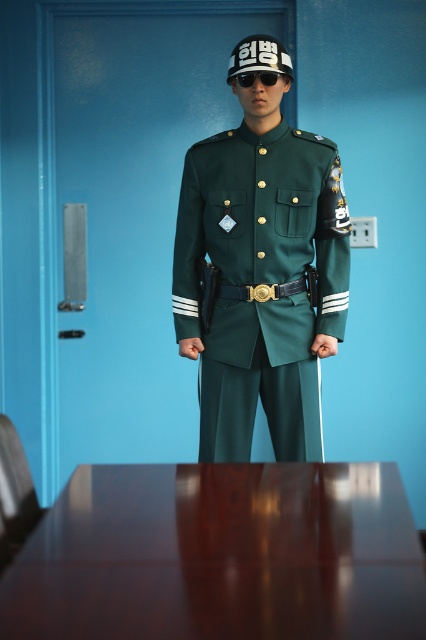
Question: Can you confirm if green matte uniform at center is smaller than black plastic sunglasses at center?

Choices:
 (A) yes
 (B) no

Answer: (B)

Question: From the image, what is the correct spatial relationship of gold metallic belt at center in relation to black plastic sunglasses at center?

Choices:
 (A) below
 (B) above

Answer: (A)

Question: Which object is positioned closest to the gold metallic belt at center?

Choices:
 (A) glossy wood table at lower center
 (B) black plastic sunglasses at center

Answer: (B)

Question: Does green matte uniform at center have a lesser width compared to black plastic sunglasses at center?

Choices:
 (A) yes
 (B) no

Answer: (B)

Question: Among these objects, which one is farthest from the camera?

Choices:
 (A) green matte uniform at center
 (B) gold metallic belt at center

Answer: (B)

Question: Which object is the farthest from the black plastic sunglasses at center?

Choices:
 (A) glossy wood table at lower center
 (B) green matte uniform at center
 (C) gold metallic belt at center

Answer: (A)